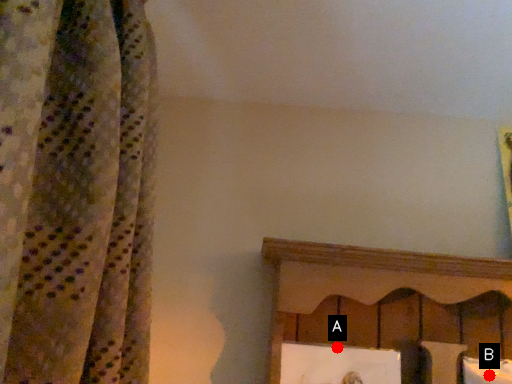
Question: Two points are circled on the image, labeled by A and B beside each circle. Among these points, which one is nearest to the camera?

Choices:
 (A) A is closer
 (B) B is closer

Answer: (B)